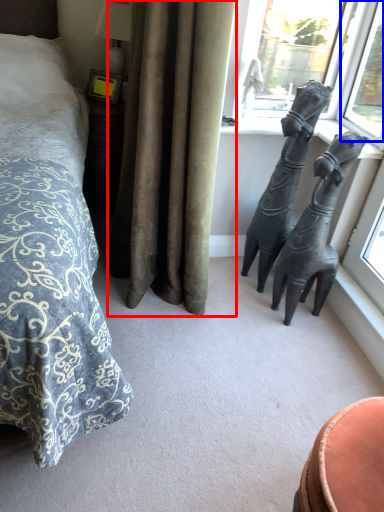
Question: Which point is further to the camera, curtain (highlighted by a red box) or window (highlighted by a blue box)?

Choices:
 (A) curtain
 (B) window

Answer: (B)